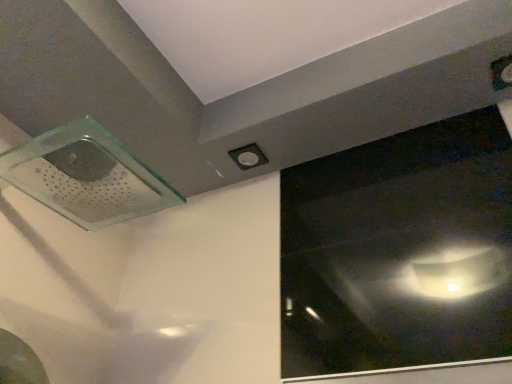
Identify the location of white plastic hole at upper center. The width and height of the screenshot is (512, 384). (248, 156).

What do you see at coordinates (248, 156) in the screenshot? I see `white plastic hole at upper center` at bounding box center [248, 156].

This screenshot has width=512, height=384. Identify the location of white plastic hole at upper center. (248, 156).